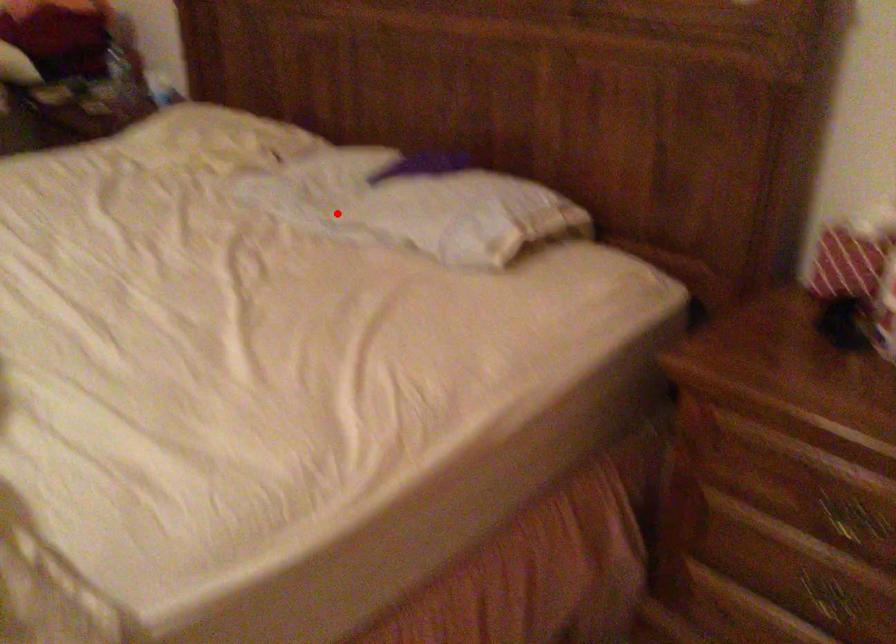
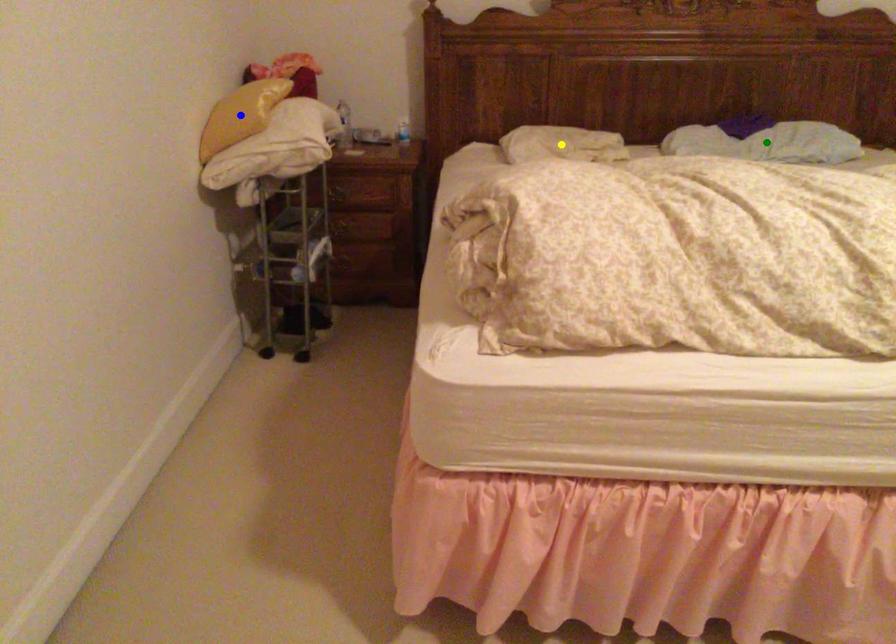
Question: I am providing you with two images of the same scene from different viewpoints. A red point is marked on the first image. You are given multiple points on the second image. Which point in image 2 is actually the same real-world point as the red point in image 1?

Choices:
 (A) blue point
 (B) yellow point
 (C) green point

Answer: (C)